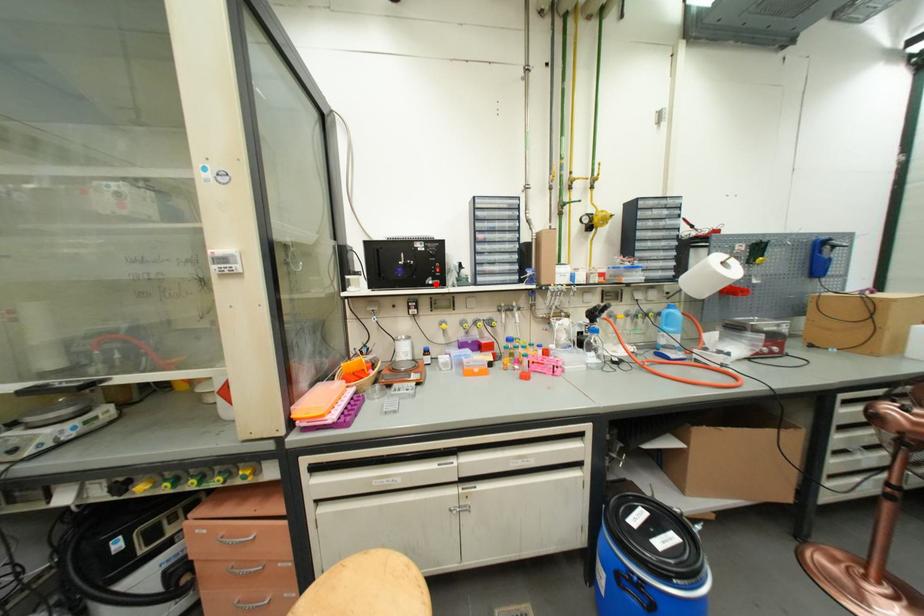
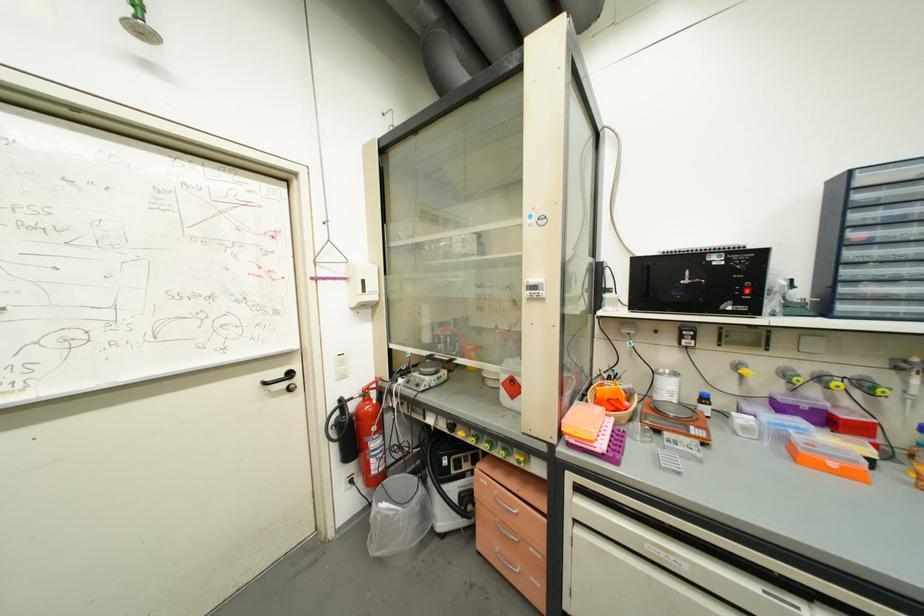
Where in the second image is the point corresponding to the highlighted location from the first image?

(735, 310)